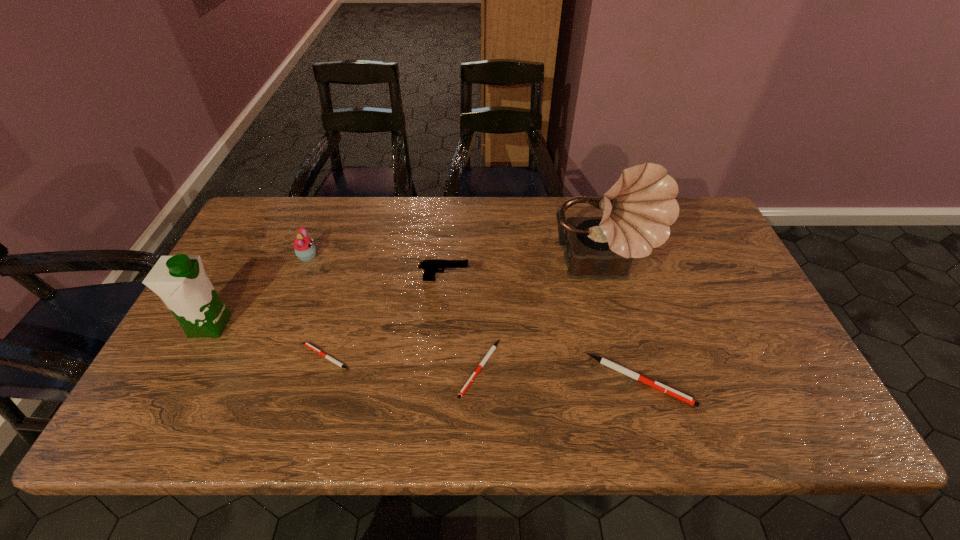
Where is `free region that satisfies the following two spatial constraints: 1. from the horn of the record player; 2. on the front-facing side of the leftmost object`? free region that satisfies the following two spatial constraints: 1. from the horn of the record player; 2. on the front-facing side of the leftmost object is located at coordinates (617, 325).